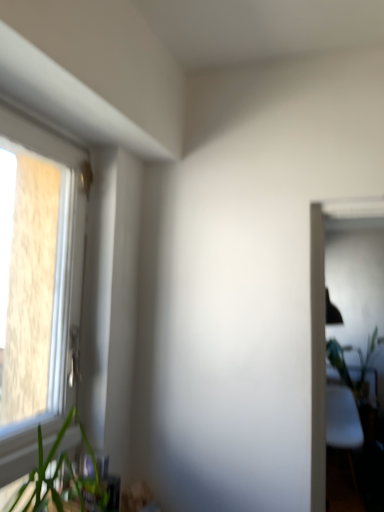
From the picture: Measure the distance between green leafy plant at right and camera.

They are 13.90 feet apart.

I want to click on green leafy plant at lower left, so click(69, 476).

Does green leafy plant at lower left touch green leafy plant at right?

No, green leafy plant at lower left is not making contact with green leafy plant at right.

From a real-world perspective, which object stands above the other?

green leafy plant at lower left, from a real-world perspective.

This screenshot has width=384, height=512. In order to click on vegetation below the green leafy plant at lower left (from the image's perspective) in this screenshot , I will do `click(351, 367)`.

Does point (73, 407) come behind point (369, 354)?

No, it is in front of (369, 354).

Would you say green leafy plant at right is inside or outside green leafy plant at lower left?

green leafy plant at right is spatially situated outside green leafy plant at lower left.

Which of these two, green leafy plant at right or green leafy plant at lower left, is thinner?

green leafy plant at lower left.

In the image, is green leafy plant at right on the left side or the right side of green leafy plant at lower left?

Based on their positions, green leafy plant at right is located to the right of green leafy plant at lower left.

Looking at the image, does green leafy plant at right seem bigger or smaller compared to green leafy plant at lower left?

Considering their sizes, green leafy plant at right takes up more space than green leafy plant at lower left.

How much distance is there between white plastic window at left and green leafy plant at lower left?

white plastic window at left and green leafy plant at lower left are 13.67 inches apart.

Is white plastic window at left to the right of green leafy plant at lower left from the viewer's perspective?

No, white plastic window at left is not to the right of green leafy plant at lower left.

Based on the photo, between white plastic window at left and green leafy plant at lower left, which one has smaller size?

With smaller size is green leafy plant at lower left.

Can you confirm if green leafy plant at lower left is positioned to the right of white plastic window at left?

Indeed, green leafy plant at lower left is positioned on the right side of white plastic window at left.

From the image's perspective, does green leafy plant at lower left appear lower than white plastic window at left?

Correct, green leafy plant at lower left appears lower than white plastic window at left in the image.

Which is in front, point (58, 436) or point (27, 425)?

Positioned in front is point (27, 425).

Which point is more distant from viewer, [342,364] or [4,192]?

Positioned behind is point [342,364].

From a real-world perspective, does green leafy plant at right stand above white plastic window at left?

Actually, green leafy plant at right is physically below white plastic window at left in the real world.

Which of these two, green leafy plant at right or white plastic window at left, is thinner?

white plastic window at left.

Can you confirm if green leafy plant at right is taller than white plastic window at left?

In fact, green leafy plant at right may be shorter than white plastic window at left.

Would you consider white plastic window at left to be distant from green leafy plant at right?

white plastic window at left is positioned a significant distance from green leafy plant at right.

From a real-world perspective, is white plastic window at left on top of green leafy plant at right?

Yes, from a real-world perspective, white plastic window at left is above green leafy plant at right.

From the image's perspective, which is above, white plastic window at left or green leafy plant at right?

From the image's view, white plastic window at left is above.

Where is `houseplant located above the green leafy plant at right (from a real-world perspective)`? houseplant located above the green leafy plant at right (from a real-world perspective) is located at coordinates (69, 476).

Where is `houseplant that appears on the left of green leafy plant at right`? The width and height of the screenshot is (384, 512). houseplant that appears on the left of green leafy plant at right is located at coordinates (69, 476).

Based on the photo, when comparing their distances from white plastic window at left, does green leafy plant at right or green leafy plant at lower left seem further?

green leafy plant at right is positioned further to the anchor white plastic window at left.

From the image, which object appears to be farther from white plastic window at left, green leafy plant at lower left or green leafy plant at right?

Based on the image, green leafy plant at right appears to be further to white plastic window at left.

Based on their spatial positions, is green leafy plant at right or white plastic window at left further from green leafy plant at lower left?

green leafy plant at right is further to green leafy plant at lower left.

When comparing their distances from green leafy plant at lower left, does white plastic window at left or green leafy plant at right seem closer?

Based on the image, white plastic window at left appears to be nearer to green leafy plant at lower left.

Looking at the image, which one is located further to green leafy plant at right, green leafy plant at lower left or white plastic window at left?

white plastic window at left lies further to green leafy plant at right than the other object.

Looking at this image, which object lies nearer to the anchor point green leafy plant at right, white plastic window at left or green leafy plant at lower left?

Among the two, green leafy plant at lower left is located nearer to green leafy plant at right.

Find the location of `window positioned between green leafy plant at lower left and green leafy plant at right from near to far`. window positioned between green leafy plant at lower left and green leafy plant at right from near to far is located at coordinates (37, 285).